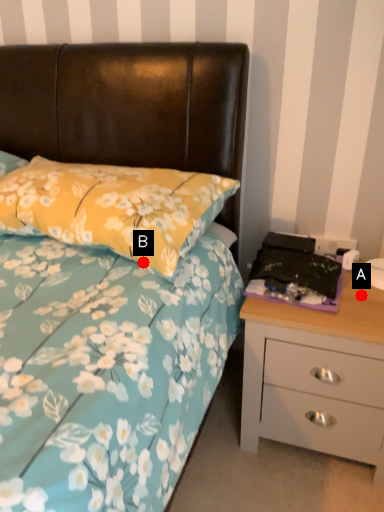
Question: Two points are circled on the image, labeled by A and B beside each circle. Among these points, which one is farthest from the camera?

Choices:
 (A) A is further
 (B) B is further

Answer: (A)